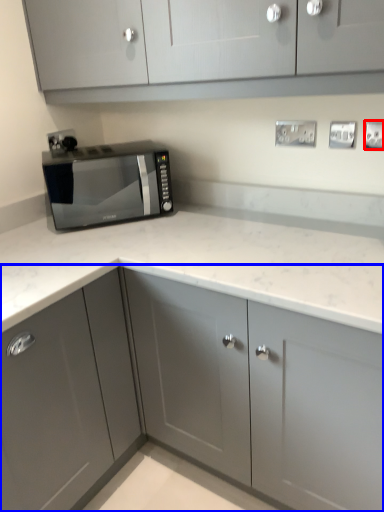
Question: Which object is closer to the camera taking this photo, electric outlet (highlighted by a red box) or cabinetry (highlighted by a blue box)?

Choices:
 (A) electric outlet
 (B) cabinetry

Answer: (B)